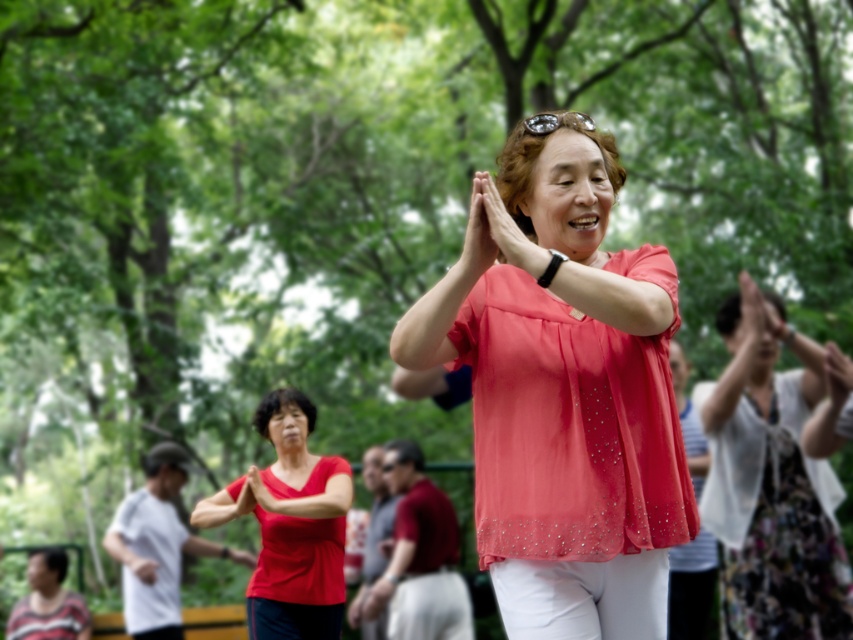
Is floral dress at center smaller than matte red blouse at center?

Actually, floral dress at center might be larger than matte red blouse at center.

Does point (827, 499) come farther from viewer compared to point (312, 554)?

Yes, it is.

The width and height of the screenshot is (853, 640). Identify the location of floral dress at center. (770, 481).

Can you confirm if matte pink blouse at center is positioned below matte red blouse at center?

Actually, matte pink blouse at center is above matte red blouse at center.

Does matte pink blouse at center have a smaller size compared to matte red blouse at center?

Yes.

Which is behind, point (616, 488) or point (318, 472)?

Positioned behind is point (318, 472).

Where is `matte pink blouse at center`? The image size is (853, 640). matte pink blouse at center is located at coordinates (563, 392).

Does matte pink blouse at center have a lesser width compared to floral dress at center?

Correct, matte pink blouse at center's width is less than floral dress at center's.

Is point (544, 172) positioned behind point (779, 632)?

No, it is in front of (779, 632).

Is point (403, 340) positioned behind point (728, 372)?

No, it is not.

Image resolution: width=853 pixels, height=640 pixels. What are the coordinates of `matte pink blouse at center` in the screenshot? It's located at (563, 392).